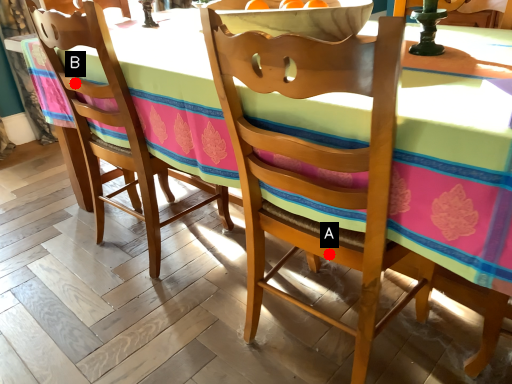
Question: Two points are circled on the image, labeled by A and B beside each circle. Which point is further to the camera?

Choices:
 (A) A is further
 (B) B is further

Answer: (B)